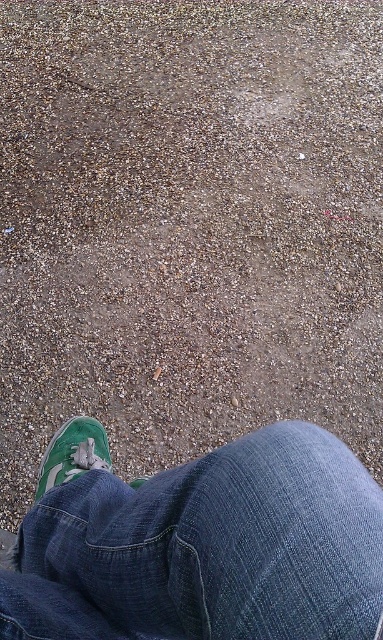
Question: Can you confirm if denim at lower center is positioned to the right of green suede shoe at lower left?

Choices:
 (A) yes
 (B) no

Answer: (A)

Question: Among these objects, which one is nearest to the camera?

Choices:
 (A) green suede shoe at lower left
 (B) denim at lower center

Answer: (B)

Question: Is denim at lower center in front of green suede shoe at lower left?

Choices:
 (A) yes
 (B) no

Answer: (A)

Question: Is denim at lower center bigger than green suede shoe at lower left?

Choices:
 (A) yes
 (B) no

Answer: (A)

Question: Which point is closer to the camera?

Choices:
 (A) denim at lower center
 (B) green suede shoe at lower left

Answer: (A)

Question: Which point is farther from the camera taking this photo?

Choices:
 (A) (101, 433)
 (B) (238, 484)

Answer: (A)